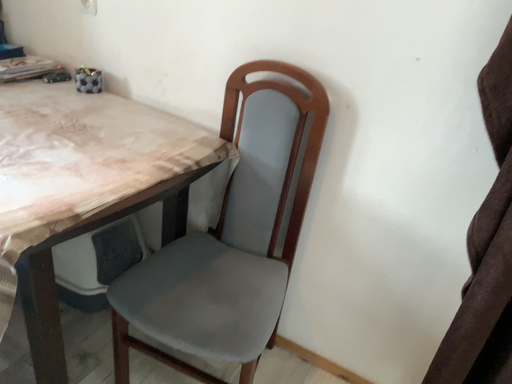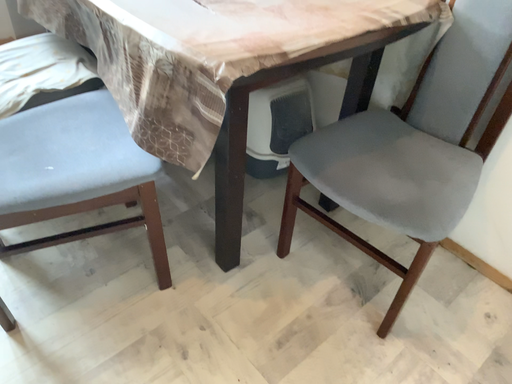
Question: Which way did the camera rotate in the video?

Choices:
 (A) rotated upward
 (B) rotated downward

Answer: (B)